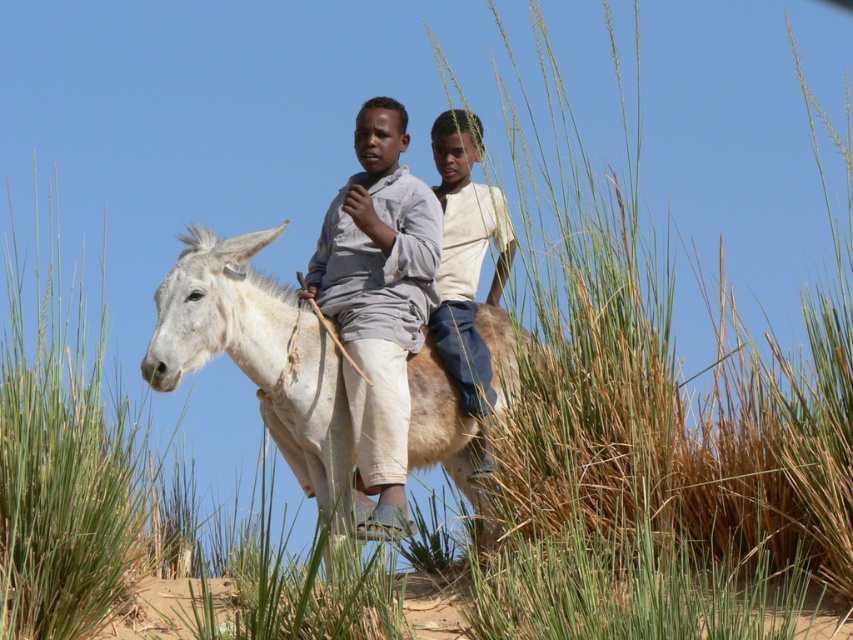
Question: In this image, where is light gray cotton shirt at center located relative to light brown cotton shirt at center?

Choices:
 (A) below
 (B) above

Answer: (A)

Question: Is light gray cotton shirt at center smaller than light brown cotton shirt at center?

Choices:
 (A) no
 (B) yes

Answer: (A)

Question: Does white matte mule at center come in front of light gray cotton shirt at center?

Choices:
 (A) yes
 (B) no

Answer: (B)

Question: Based on their relative distances, which object is nearer to the light brown cotton shirt at center?

Choices:
 (A) light gray cotton shirt at center
 (B) white matte mule at center

Answer: (A)

Question: Which object appears closest to the camera in this image?

Choices:
 (A) light gray cotton shirt at center
 (B) light brown cotton shirt at center

Answer: (A)

Question: Which of the following is the closest to the observer?

Choices:
 (A) (312, 449)
 (B) (444, 138)
 (C) (364, 244)

Answer: (A)